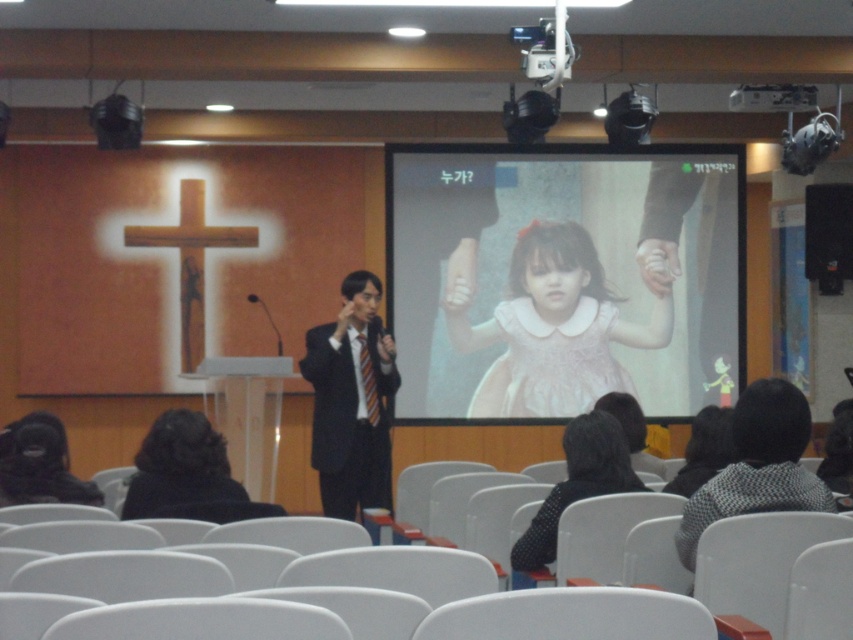
You are an event planner organizing a photoshoot in the conference room. You need to position a 2m tall backdrop behind the black suit at center and the black dotted blouse at lower center. Which object will have more space above it when the backdrop is placed?

The black suit at center has a greater height compared to the black dotted blouse at lower center. Therefore, the black dotted blouse at lower center will have more space above it when the backdrop is placed behind both objects.

You are organizing a photo shoot and need to ensure that the pink satin dress at center and the black suit at center are positioned at least 2 meters apart for proper lighting. Based on the scene described, will their current positioning meet this requirement?

The pink satin dress at center and black suit at center are 2.34 meters apart, which exceeds the minimum requirement of 2 meters. Therefore, their current positioning meets the requirement.

You are organizing a photo shoot and need to ensure that both the pink satin dress at center and the black suit at center are visible in the frame. Based on their positions and sizes, which object should you prioritize positioning first to ensure both fit comfortably in the shot?

The pink satin dress at center might be wider than black suit at center, so you should prioritize positioning the pink satin dress at center first to ensure there is enough space for both in the frame.